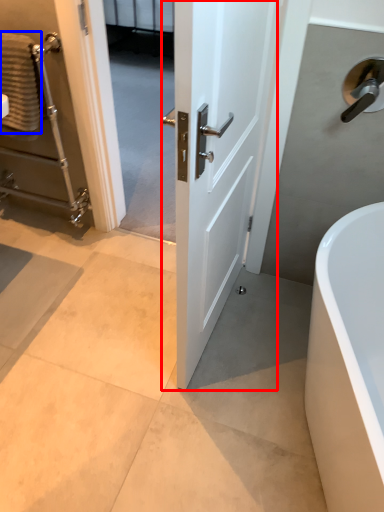
Question: Which object appears closest to the camera in this image, door (highlighted by a red box) or material (highlighted by a blue box)?

Choices:
 (A) door
 (B) material

Answer: (A)